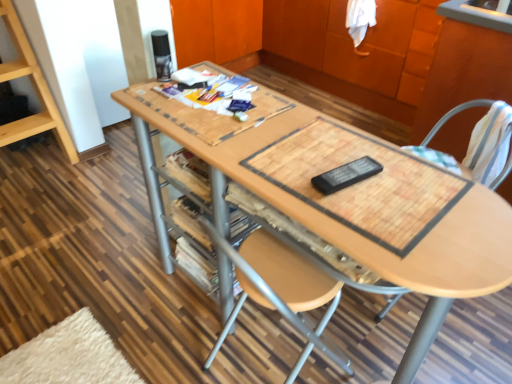
Locate an element on the screen. vacant space situated above bamboo placemat at center (from a real-world perspective) is located at coordinates (366, 185).